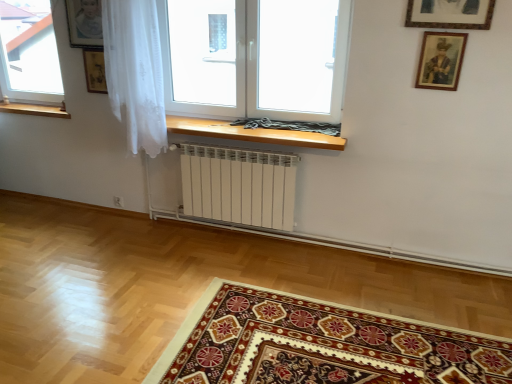
This screenshot has width=512, height=384. Describe the element at coordinates (29, 52) in the screenshot. I see `transparent glass window at upper left, arranged as the second window when viewed from the right` at that location.

Where is `transparent glass window at center, the second window positioned from the left`? Image resolution: width=512 pixels, height=384 pixels. transparent glass window at center, the second window positioned from the left is located at coordinates click(x=255, y=58).

I want to click on carpet with intricate patterns at lower center, so click(x=320, y=345).

Where is `transparent glass window at upper left, the 1th window from the left`? The image size is (512, 384). transparent glass window at upper left, the 1th window from the left is located at coordinates (29, 52).

Considering the positions of point (7, 38) and point (186, 23), is point (7, 38) closer or farther from the camera than point (186, 23)?

Point (7, 38) is farther from the camera than point (186, 23).

Based on the photo, considering the relative sizes of transparent glass window at upper left, arranged as the second window when viewed from the right, and transparent glass window at center, the second window positioned from the left, in the image provided, is transparent glass window at upper left, arranged as the second window when viewed from the right, smaller than transparent glass window at center, the second window positioned from the left,?

Yes.

Visually, is transparent glass window at upper left, arranged as the second window when viewed from the right, positioned to the left or to the right of transparent glass window at center, the first window positioned from the right?

From the image, it's evident that transparent glass window at upper left, arranged as the second window when viewed from the right, is to the left of transparent glass window at center, the first window positioned from the right.

Is transparent glass window at upper left, arranged as the second window when viewed from the right, far away from transparent glass window at center, the second window positioned from the left?

transparent glass window at upper left, arranged as the second window when viewed from the right, is positioned a significant distance from transparent glass window at center, the second window positioned from the left.

From the image's perspective, does transparent glass window at center, the second window positioned from the left, appear lower than transparent glass window at upper left, the 1th window from the left?

Indeed, from the image's perspective, transparent glass window at center, the second window positioned from the left, is shown beneath transparent glass window at upper left, the 1th window from the left.

Which object is more forward, transparent glass window at center, the first window positioned from the right, or transparent glass window at upper left, arranged as the second window when viewed from the right?

transparent glass window at center, the first window positioned from the right.

Is transparent glass window at center, the second window positioned from the left, to the right of transparent glass window at upper left, the 1th window from the left, from the viewer's perspective?

Indeed, transparent glass window at center, the second window positioned from the left, is positioned on the right side of transparent glass window at upper left, the 1th window from the left.

Between transparent glass window at center, the first window positioned from the right, and transparent glass window at upper left, arranged as the second window when viewed from the right, which one has less height?

With less height is transparent glass window at center, the first window positioned from the right.

Would you say carpet with intricate patterns at lower center is outside transparent glass window at center, the second window positioned from the left?

Absolutely, carpet with intricate patterns at lower center is external to transparent glass window at center, the second window positioned from the left.

Could you tell me if carpet with intricate patterns at lower center is facing transparent glass window at center, the first window positioned from the right?

No, carpet with intricate patterns at lower center is not oriented towards transparent glass window at center, the first window positioned from the right.

Consider the image. Which of these two, carpet with intricate patterns at lower center or transparent glass window at center, the first window positioned from the right, is thinner?

transparent glass window at center, the first window positioned from the right, is thinner.

Considering the sizes of objects carpet with intricate patterns at lower center and transparent glass window at center, the first window positioned from the right, in the image provided, who is bigger, carpet with intricate patterns at lower center or transparent glass window at center, the first window positioned from the right,?

transparent glass window at center, the first window positioned from the right.

Considering their positions, is transparent glass window at center, the second window positioned from the left, located in front of or behind carpet with intricate patterns at lower center?

Clearly, transparent glass window at center, the second window positioned from the left, is behind carpet with intricate patterns at lower center.

From the image's perspective, between transparent glass window at center, the first window positioned from the right, and carpet with intricate patterns at lower center, which one is located above?

transparent glass window at center, the first window positioned from the right, from the image's perspective.

Between transparent glass window at center, the first window positioned from the right, and carpet with intricate patterns at lower center, which one has smaller width?

Thinner between the two is transparent glass window at center, the first window positioned from the right.

From a real-world perspective, relative to carpet with intricate patterns at lower center, is transparent glass window at center, the second window positioned from the left, vertically above or below?

transparent glass window at center, the second window positioned from the left, is above carpet with intricate patterns at lower center.

Is there a large distance between transparent glass window at upper left, the 1th window from the left, and carpet with intricate patterns at lower center?

Yes, transparent glass window at upper left, the 1th window from the left, and carpet with intricate patterns at lower center are located far from each other.

Based on the photo, is transparent glass window at upper left, arranged as the second window when viewed from the right, to the left of carpet with intricate patterns at lower center from the viewer's perspective?

Yes, transparent glass window at upper left, arranged as the second window when viewed from the right, is to the left of carpet with intricate patterns at lower center.

Considering the sizes of objects transparent glass window at upper left, arranged as the second window when viewed from the right, and carpet with intricate patterns at lower center in the image provided, who is shorter, transparent glass window at upper left, arranged as the second window when viewed from the right, or carpet with intricate patterns at lower center?

carpet with intricate patterns at lower center.

What's the angular difference between transparent glass window at upper left, arranged as the second window when viewed from the right, and carpet with intricate patterns at lower center's facing directions?

The angle between the facing direction of transparent glass window at upper left, arranged as the second window when viewed from the right, and the facing direction of carpet with intricate patterns at lower center is 89.6 degrees.

Based on the photo, measure the distance between carpet with intricate patterns at lower center and transparent glass window at upper left, arranged as the second window when viewed from the right.

They are 3.22 meters apart.

Based on their sizes in the image, would you say carpet with intricate patterns at lower center is bigger or smaller than transparent glass window at upper left, the 1th window from the left?

Considering their sizes, carpet with intricate patterns at lower center takes up more space than transparent glass window at upper left, the 1th window from the left.

Does carpet with intricate patterns at lower center come in front of transparent glass window at upper left, the 1th window from the left?

Yes, it is in front of transparent glass window at upper left, the 1th window from the left.

Considering the sizes of objects carpet with intricate patterns at lower center and transparent glass window at upper left, arranged as the second window when viewed from the right, in the image provided, who is wider, carpet with intricate patterns at lower center or transparent glass window at upper left, arranged as the second window when viewed from the right,?

carpet with intricate patterns at lower center.

Locate an element on the screen. Image resolution: width=512 pixels, height=384 pixels. window on the left of transparent glass window at center, the second window positioned from the left is located at coordinates (29, 52).

Find the location of a particular element. This screenshot has width=512, height=384. window that is under the transparent glass window at center, the first window positioned from the right (from a real-world perspective) is located at coordinates (29, 52).

Estimate the real-world distances between objects in this image. Which object is closer to carpet with intricate patterns at lower center, transparent glass window at upper left, the 1th window from the left, or transparent glass window at center, the second window positioned from the left?

transparent glass window at center, the second window positioned from the left, is closer to carpet with intricate patterns at lower center.

Looking at the image, which one is located further to carpet with intricate patterns at lower center, transparent glass window at center, the first window positioned from the right, or transparent glass window at upper left, the 1th window from the left?

transparent glass window at upper left, the 1th window from the left, lies further to carpet with intricate patterns at lower center than the other object.

When comparing their distances from transparent glass window at upper left, the 1th window from the left, does carpet with intricate patterns at lower center or transparent glass window at center, the first window positioned from the right, seem further?

carpet with intricate patterns at lower center is further to transparent glass window at upper left, the 1th window from the left.

Considering their positions, is transparent glass window at upper left, arranged as the second window when viewed from the right, positioned closer to transparent glass window at center, the second window positioned from the left, than carpet with intricate patterns at lower center?

Based on the image, carpet with intricate patterns at lower center appears to be nearer to transparent glass window at center, the second window positioned from the left.

When comparing their distances from transparent glass window at upper left, arranged as the second window when viewed from the right, does transparent glass window at center, the first window positioned from the right, or carpet with intricate patterns at lower center seem further?

carpet with intricate patterns at lower center.

From the image, which object appears to be farther from transparent glass window at center, the first window positioned from the right, carpet with intricate patterns at lower center or transparent glass window at upper left, the 1th window from the left?

transparent glass window at upper left, the 1th window from the left, is further to transparent glass window at center, the first window positioned from the right.

This screenshot has width=512, height=384. In order to click on window situated between transparent glass window at upper left, arranged as the second window when viewed from the right, and carpet with intricate patterns at lower center from left to right in this screenshot , I will do `click(255, 58)`.